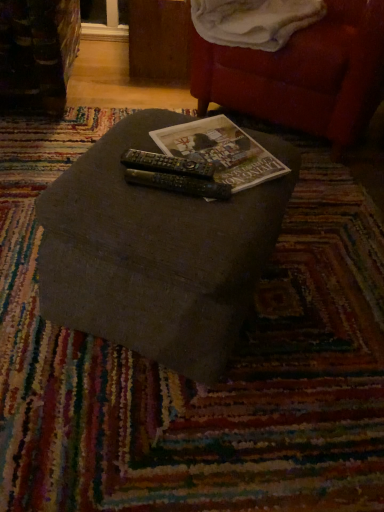
The height and width of the screenshot is (512, 384). In order to click on free location to the left of black plastic remote at center, acting as the second remote starting from the back in this screenshot , I will do [x=106, y=179].